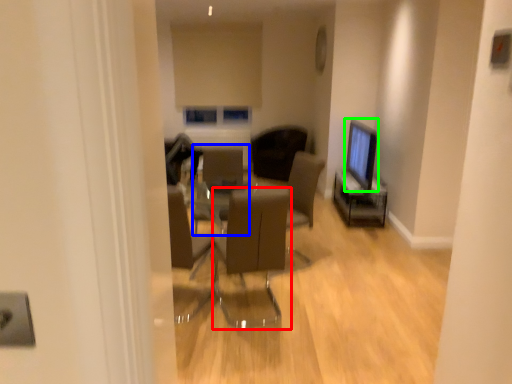
Question: Which is farther away from chair (highlighted by a red box)? armchair (highlighted by a blue box) or computer monitor (highlighted by a green box)?

Choices:
 (A) armchair
 (B) computer monitor

Answer: (B)